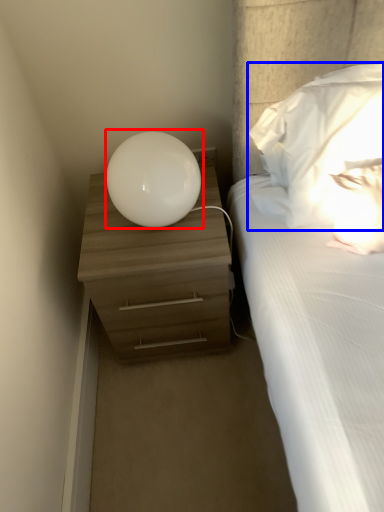
Question: Which of the following is the farthest to the observer, table lamp (highlighted by a red box) or pillow (highlighted by a blue box)?

Choices:
 (A) table lamp
 (B) pillow

Answer: (A)